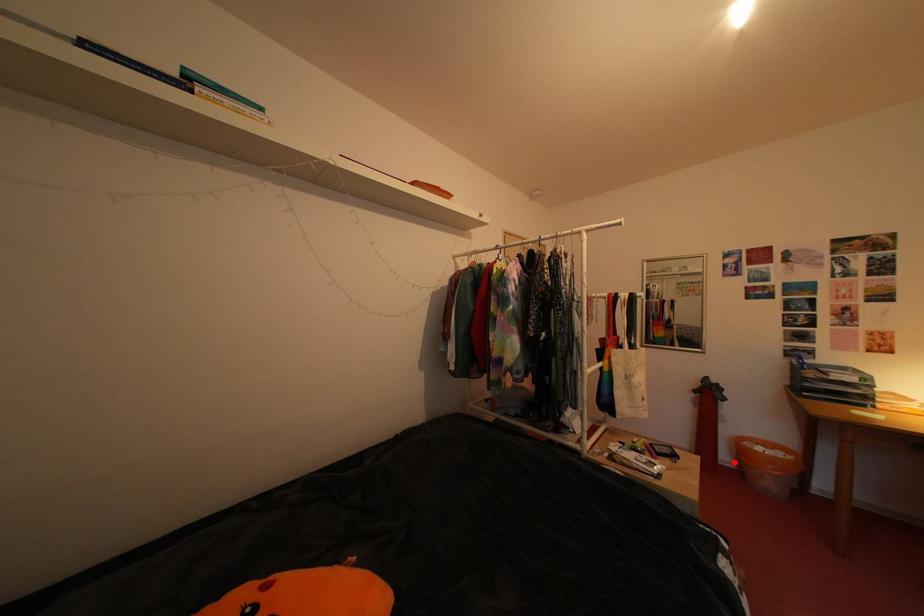
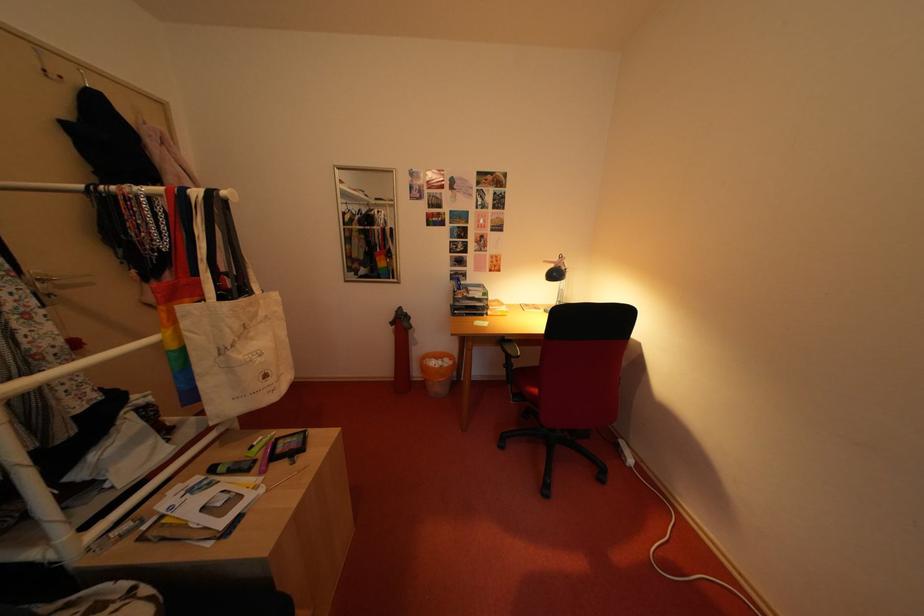
Question: A red point is marked in image1. In image2, is the corresponding 3D point closer to the camera or farther? Reply with the corresponding letter.

Choices:
 (A) The corresponding 3D point is closer.
 (B) The corresponding 3D point is farther.

Answer: (B)